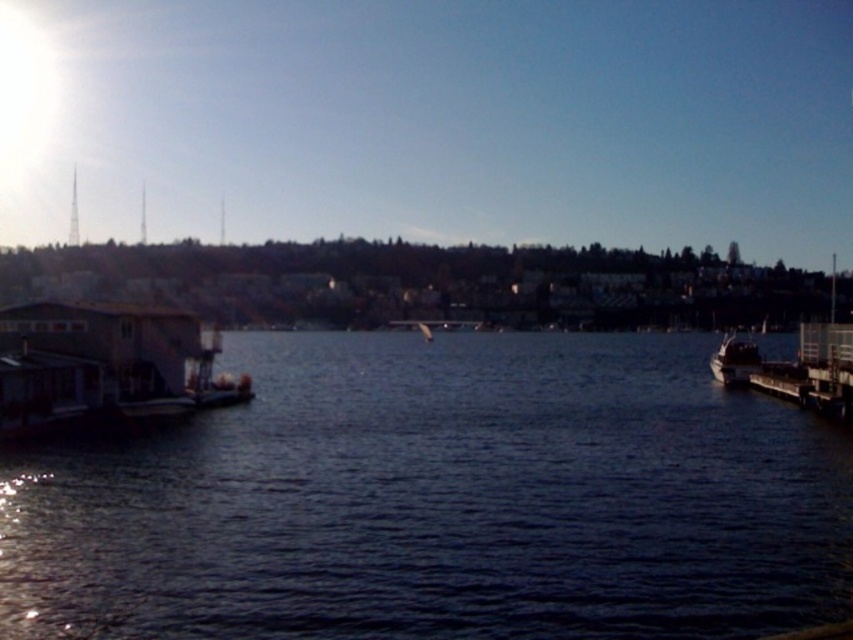
Question: Can you confirm if dark blue water at center is thinner than shiny silver boat at right?

Choices:
 (A) yes
 (B) no

Answer: (B)

Question: Which of the following is the closest to the observer?

Choices:
 (A) (755, 564)
 (B) (734, 346)

Answer: (A)

Question: Which object appears closest to the camera in this image?

Choices:
 (A) dark blue water at center
 (B) shiny silver boat at right

Answer: (A)

Question: Is dark blue water at center above shiny silver boat at right?

Choices:
 (A) yes
 (B) no

Answer: (B)

Question: Is dark blue water at center to the left of shiny silver boat at right from the viewer's perspective?

Choices:
 (A) yes
 (B) no

Answer: (A)